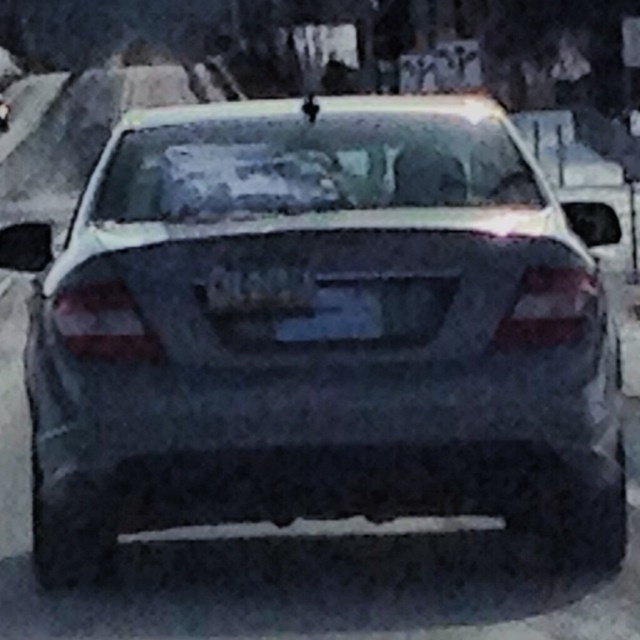
You are standing in front of a car at dusk and see two points on its rear. The first point is at coordinate point (310,280) and the second is at point (1,122). Which point is nearer to you?

Point (310,280) is closer to the viewer than point (1,122).

You are a delivery driver who needs to park your car in a tight space. You see a satin black sedan at center and a black plastic license plate at center. How far apart are these two items?

The black plastic license plate at center is 39.88 meters away from the satin black sedan at center.